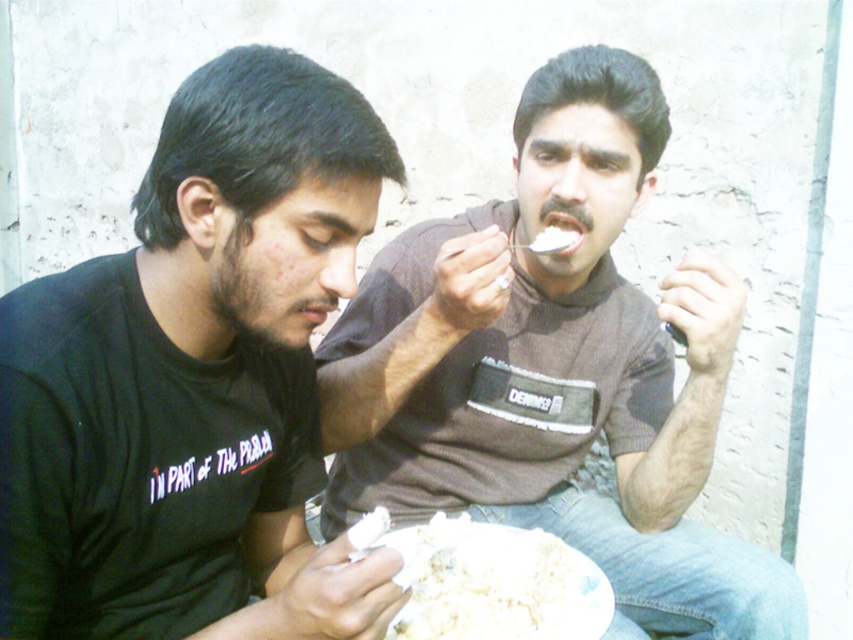
You are a photographer trying to capture the black matte t shirt at left in the image. The camera you are using has a limited field of view and can only focus on objects within a 0.2 unit radius from the center point. If you center your camera at the point (195, 381), will the black matte t shirt at left be fully within the camera frame?

The black matte t shirt at left is represented by the point (195, 381). Since the camera is centered at this exact point and the focus radius is 0.2 units, the entire t shirt will be within the frame as the distance from the center to any edge would be less than 0.2 units.

You are standing in front of the two people eating and want to place a napkin between them. Which point, point (x=287, y=570) or point (x=459, y=618), is closer to you so you can place the napkin there?

Point (x=287, y=570) is closer to you than point (x=459, y=618), so you can place the napkin there.